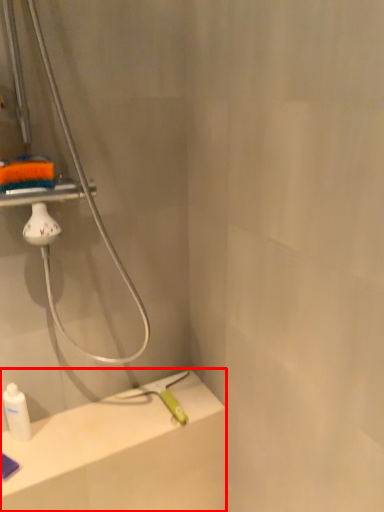
Question: From the image's perspective, what is the correct spatial relationship of counter top (annotated by the red box) in relation to bottle?

Choices:
 (A) above
 (B) below

Answer: (B)